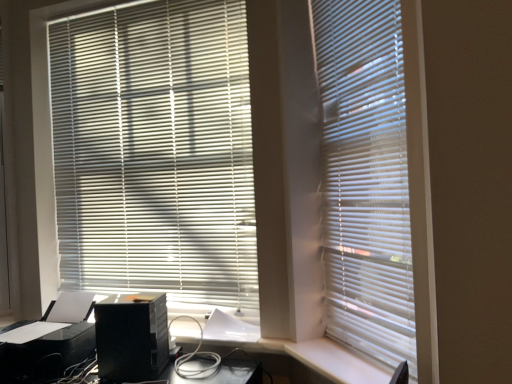
Question: Is white matte blinds at center, positioned as the second window blind in back-to-front order, positioned behind black plastic computer tower at lower left?

Choices:
 (A) no
 (B) yes

Answer: (A)

Question: Considering the relative sizes of white matte blinds at center, the 2th window blind from the left, and black plastic computer tower at lower left in the image provided, is white matte blinds at center, the 2th window blind from the left, smaller than black plastic computer tower at lower left?

Choices:
 (A) no
 (B) yes

Answer: (B)

Question: Does white matte blinds at center, the 2th window blind from the left, turn towards black plastic computer tower at lower left?

Choices:
 (A) yes
 (B) no

Answer: (B)

Question: Is white matte blinds at center, the 2th window blind from the left, at the right side of black plastic computer tower at lower left?

Choices:
 (A) yes
 (B) no

Answer: (A)

Question: From a real-world perspective, is white matte blinds at center, which is the 1th window blind from right to left, beneath black plastic computer tower at lower left?

Choices:
 (A) no
 (B) yes

Answer: (A)

Question: Would you say black plastic computer tower at lower left is inside or outside white plastic screen door at left?

Choices:
 (A) outside
 (B) inside

Answer: (A)

Question: Is point (105, 352) positioned closer to the camera than point (1, 41)?

Choices:
 (A) farther
 (B) closer

Answer: (B)

Question: Is black plastic computer tower at lower left taller or shorter than white plastic screen door at left?

Choices:
 (A) tall
 (B) short

Answer: (B)

Question: Is black plastic computer tower at lower left wider or thinner than white plastic screen door at left?

Choices:
 (A) wide
 (B) thin

Answer: (A)

Question: From their relative heights in the image, would you say black plastic printer at lower left is taller or shorter than white plastic screen door at left?

Choices:
 (A) short
 (B) tall

Answer: (A)

Question: Based on their positions, is black plastic printer at lower left located to the left or right of white plastic screen door at left?

Choices:
 (A) right
 (B) left

Answer: (A)

Question: From the image's perspective, is black plastic printer at lower left located above or below white plastic screen door at left?

Choices:
 (A) above
 (B) below

Answer: (B)

Question: Does point (24, 357) appear closer or farther from the camera than point (0, 292)?

Choices:
 (A) farther
 (B) closer

Answer: (B)

Question: From their relative heights in the image, would you say white matte blinds at center, positioned as the second window blind in back-to-front order, is taller or shorter than black plastic computer tower at lower left?

Choices:
 (A) tall
 (B) short

Answer: (A)

Question: Looking at their shapes, would you say white matte blinds at center, the 2th window blind from the left, is wider or thinner than black plastic computer tower at lower left?

Choices:
 (A) thin
 (B) wide

Answer: (A)